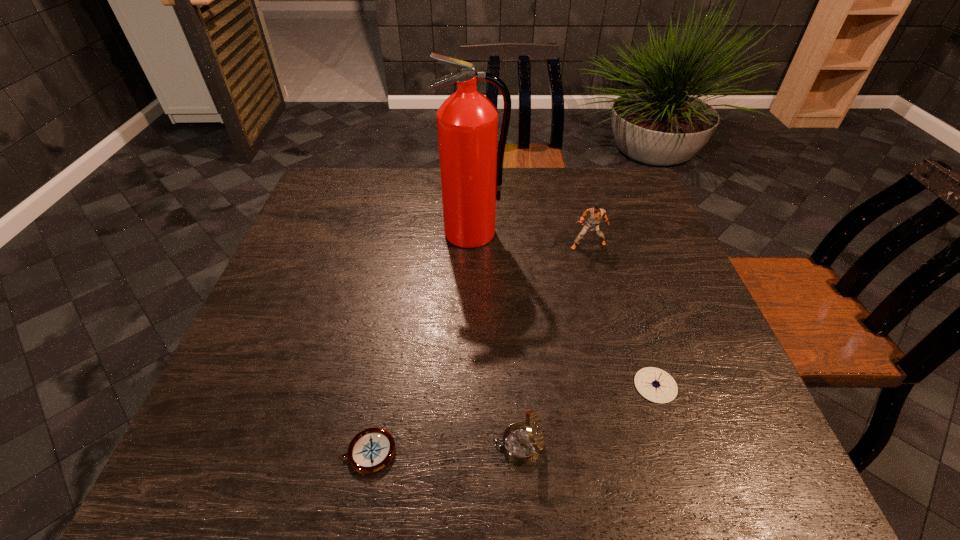
This screenshot has height=540, width=960. What are the coordinates of `free space that satisfies the following two spatial constraints: 1. on the front-facing side of the puncher; 2. with the dial facing the tallest compass` in the screenshot? It's located at (642, 444).

Image resolution: width=960 pixels, height=540 pixels. Identify the location of free space that satisfies the following two spatial constraints: 1. at the nozzle of the third farthest object; 2. on the left side of the fire extinguisher. (468, 386).